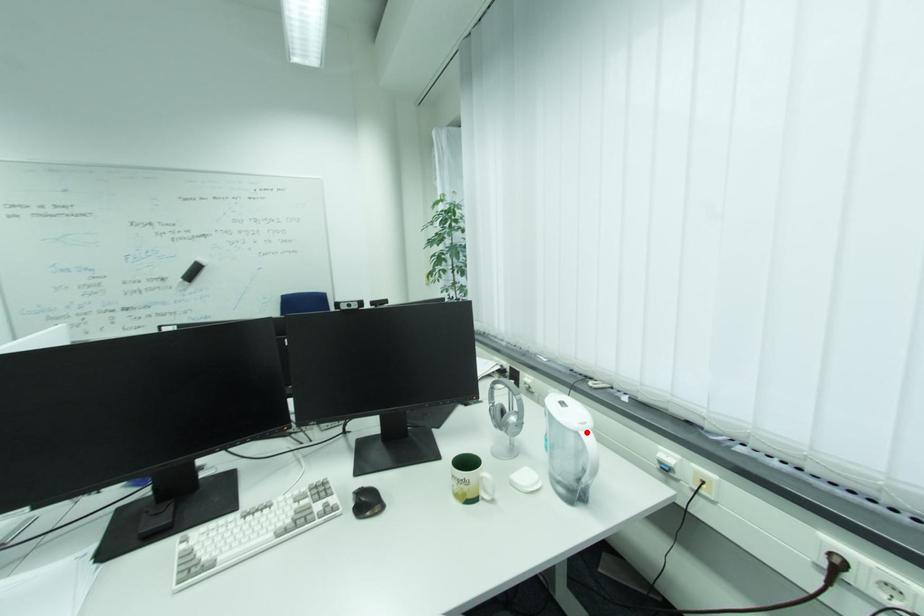
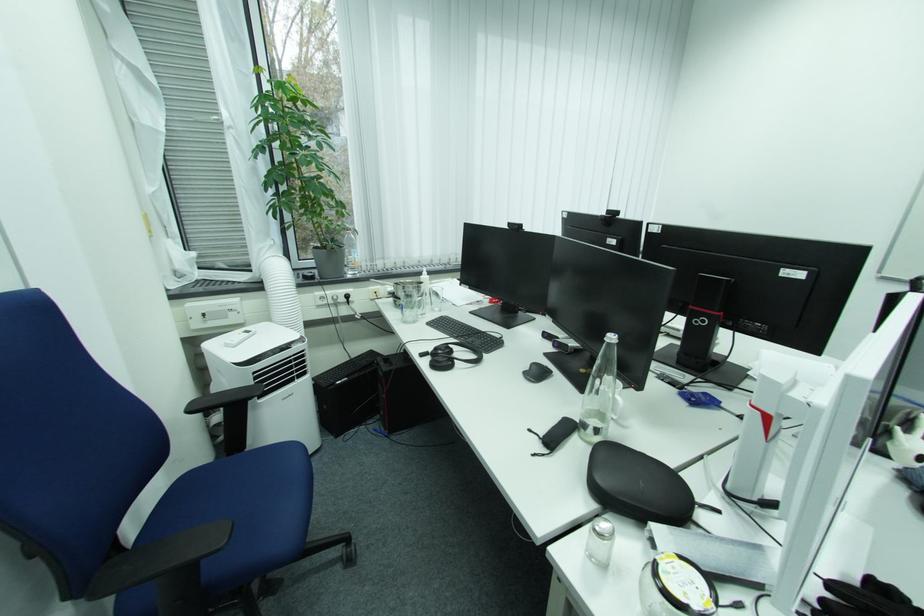
Question: I am providing you with two images of the same scene from different viewpoints. A red point is marked on the first image. At the location where the point appears in image 1, is it still visible in image 2?

Choices:
 (A) Yes
 (B) No

Answer: (B)